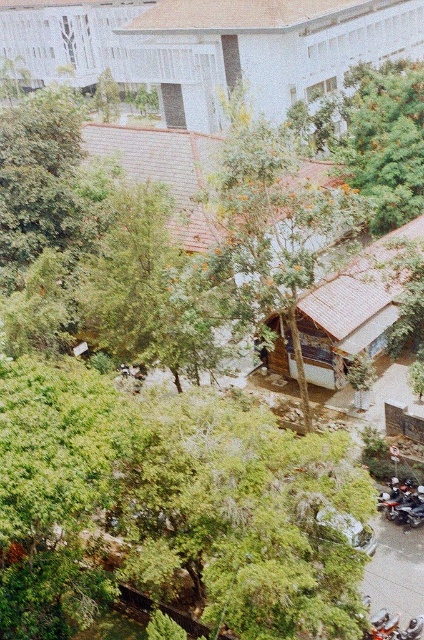
You are a drone operator tasked with capturing aerial photos of the residential area. You need to position your drone to avoid the green leafy tree at upper right. What are the coordinates you should avoid?

You should avoid the coordinates point (384, 140) where the green leafy tree at upper right is located.

Consider the image. You are a drone operator trying to capture a photo of the shiny black motorcycle at lower right. However, there is a green leafy tree at upper right in the way. Can you determine if the tree will block the view of the motorcycle?

The green leafy tree at upper right is much taller than the shiny black motorcycle at lower right, so it will block the view of the motorcycle.